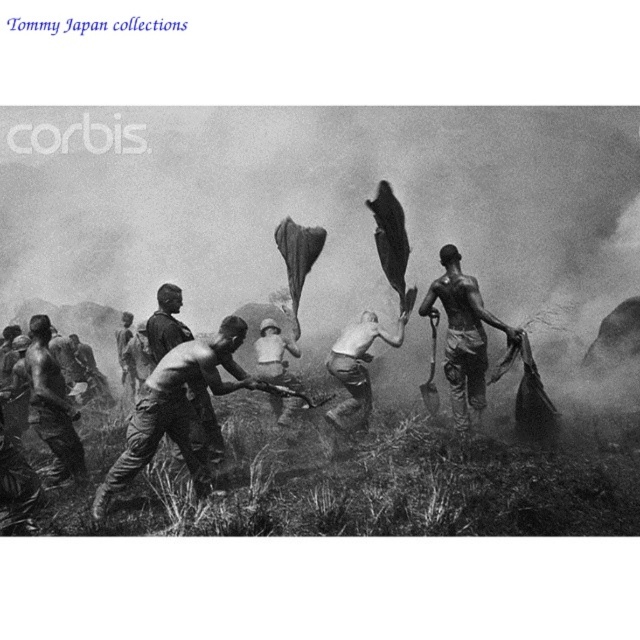
Which is below, shiny metallic shovel at right or shiny metallic helmet at center?

shiny metallic helmet at center is below.

Can you confirm if shiny metallic shovel at right is smaller than shiny metallic helmet at center?

Incorrect, shiny metallic shovel at right is not smaller in size than shiny metallic helmet at center.

Between point (451, 348) and point (353, 340), which one is positioned in front?

Point (451, 348)

Where is `shiny metallic shovel at right`? This screenshot has height=640, width=640. shiny metallic shovel at right is located at coordinates (464, 337).

Between dirty skin man at left and shiny metallic helmet at center, which one appears on the right side from the viewer's perspective?

Positioned to the right is shiny metallic helmet at center.

Who is taller, dirty skin man at left or shiny metallic helmet at center?

shiny metallic helmet at center is taller.

You are a GUI agent. You are given a task and a screenshot of the screen. Output one action in this format:
    pyautogui.click(x=<x>, y=<y>)
    Task: Click on the dirty skin man at left
    Image resolution: width=640 pixels, height=640 pixels.
    Given the screenshot: What is the action you would take?
    pyautogui.click(x=52, y=404)

The width and height of the screenshot is (640, 640). What are the coordinates of `dirty skin man at left` in the screenshot? It's located at (52, 404).

Which is below, shiny metallic shovel at right or dirty skin man at left?

dirty skin man at left

Which is behind, point (470, 394) or point (52, 444)?

Point (470, 394)

Who is more forward, (x=440, y=250) or (x=49, y=397)?

Point (x=49, y=397) is in front.

I want to click on shiny metallic shovel at right, so point(464,337).